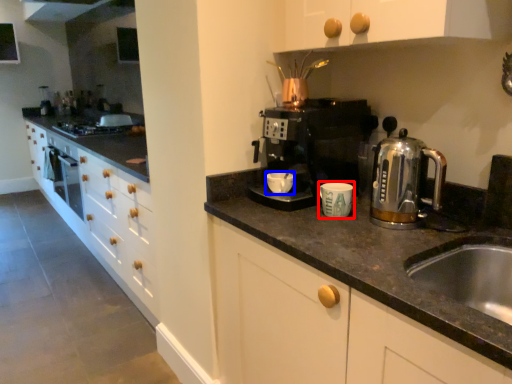
Question: Among these objects, which one is farthest to the camera, kitchen appliance (highlighted by a red box) or mug (highlighted by a blue box)?

Choices:
 (A) kitchen appliance
 (B) mug

Answer: (B)